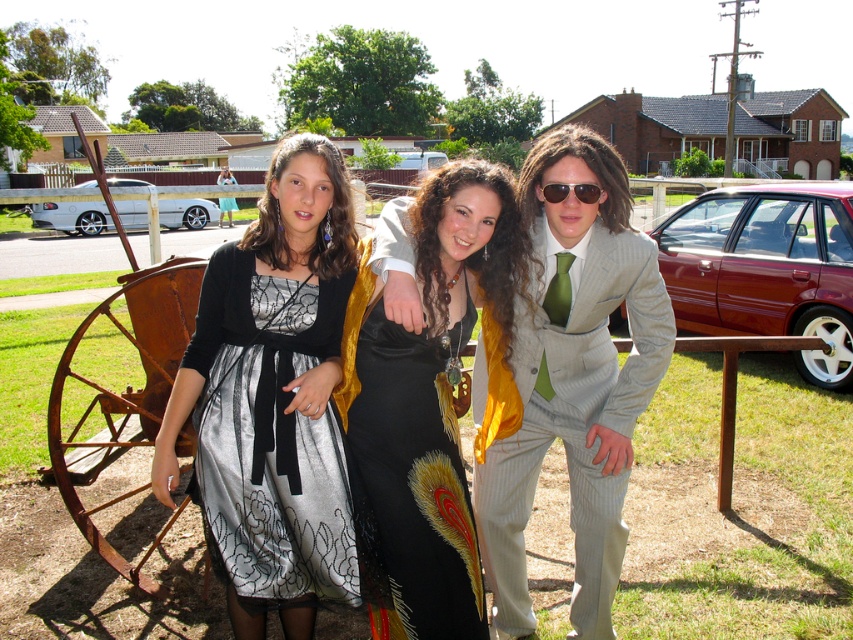
You are a photographer trying to capture a closeup shot of the person on the right. You have two points marked in the image to focus on. The first point is at coordinate point [213,250] and the second is at point [595,198]. Which point should you choose to ensure the focus is on the person on the right?

Point [213,250] is further to the camera than point [595,198]. Therefore, to focus on the person on the right, you should choose point [213,250] as it is closer to the camera.

You are a photographer trying to capture a clear shot of the sunglasses at center and the silver metallic sedan at left. Based on their positions, which object is closer to the camera?

The silver metallic sedan at left is closer to the camera than the sunglasses at center because the sunglasses at center is behind the silver metallic sedan at left.